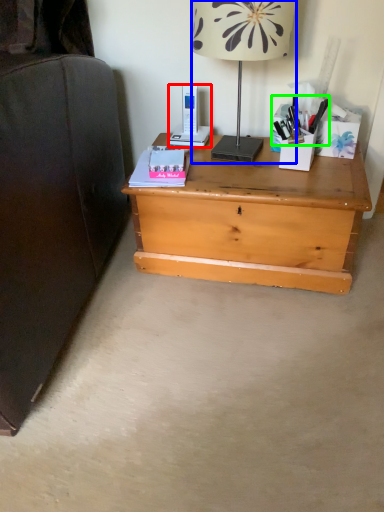
Question: Estimate the real-world distances between objects in this image. Which object is closer to gadget (highlighted by a red box), lamp (highlighted by a blue box) or stationery (highlighted by a green box)?

Choices:
 (A) lamp
 (B) stationery

Answer: (A)